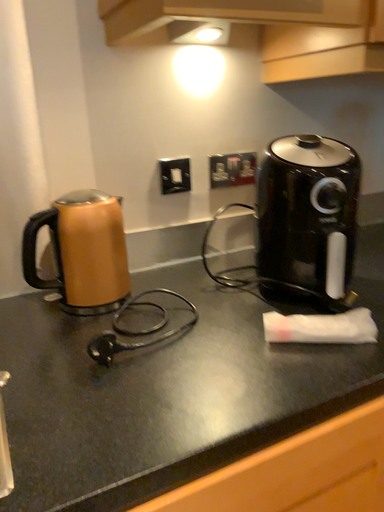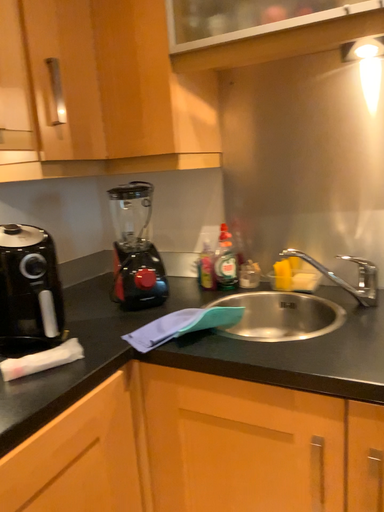
Question: Which way did the camera rotate in the video?

Choices:
 (A) rotated left
 (B) rotated right

Answer: (B)